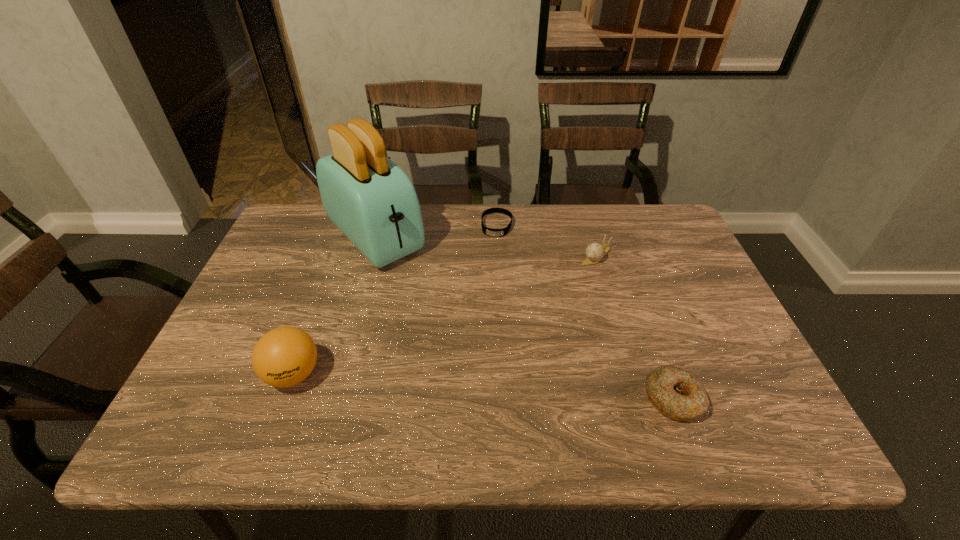
I want to click on free space on the desktop that is between the ping-pong ball and the doughnut and is positioned on the side of the toaster with the lever, so click(x=531, y=390).

Locate an element on the screen. The height and width of the screenshot is (540, 960). vacant spot on the desktop that is between the fourth shortest object and the doughnut and is positioned on the shell of the escargot is located at coordinates (479, 387).

The width and height of the screenshot is (960, 540). Find the location of `vacant space on the desktop that is between the ping-pong ball and the doughnut and is positioned on the display of the wristband`. vacant space on the desktop that is between the ping-pong ball and the doughnut and is positioned on the display of the wristband is located at coordinates (468, 386).